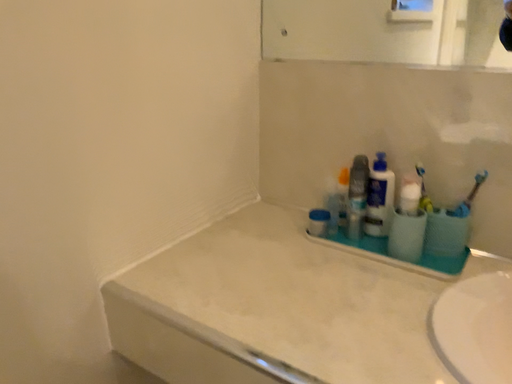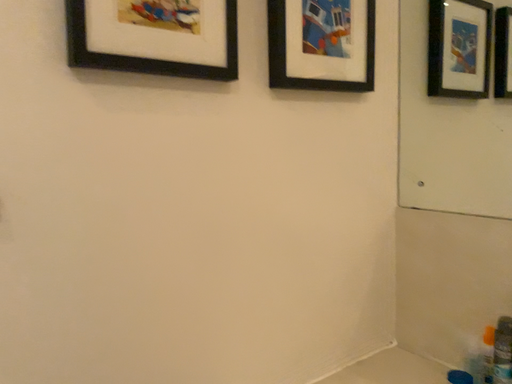
Question: Which way did the camera rotate in the video?

Choices:
 (A) rotated left
 (B) rotated right

Answer: (A)